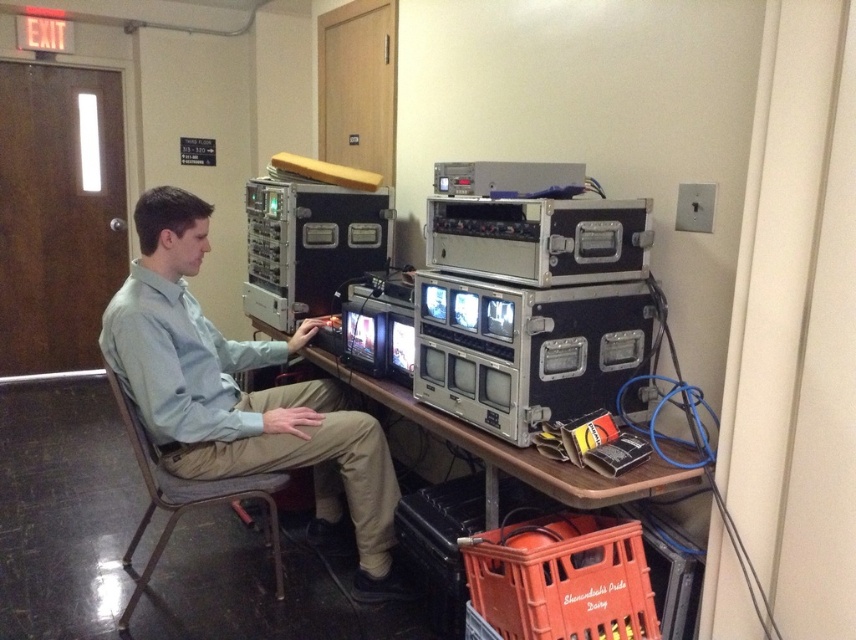
You are a safety inspector checking the workspace. You notice the light blue shirt at center and the gray fabric chair at center. According to safety regulations, the chair must be larger than the shirt to ensure proper ergonomic support. Does the current setup comply with the regulations?

The light blue shirt at center is bigger than gray fabric chair at center. This means the chair is smaller than required, so the setup does not comply with safety regulations.

Where is the light blue shirt at center located in the image?

The light blue shirt at center is located at point [242,396].